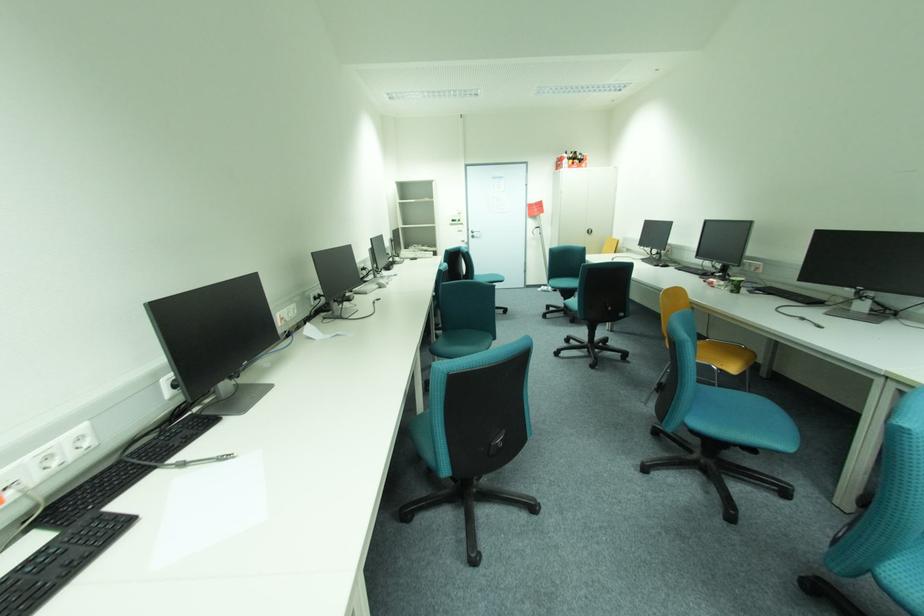
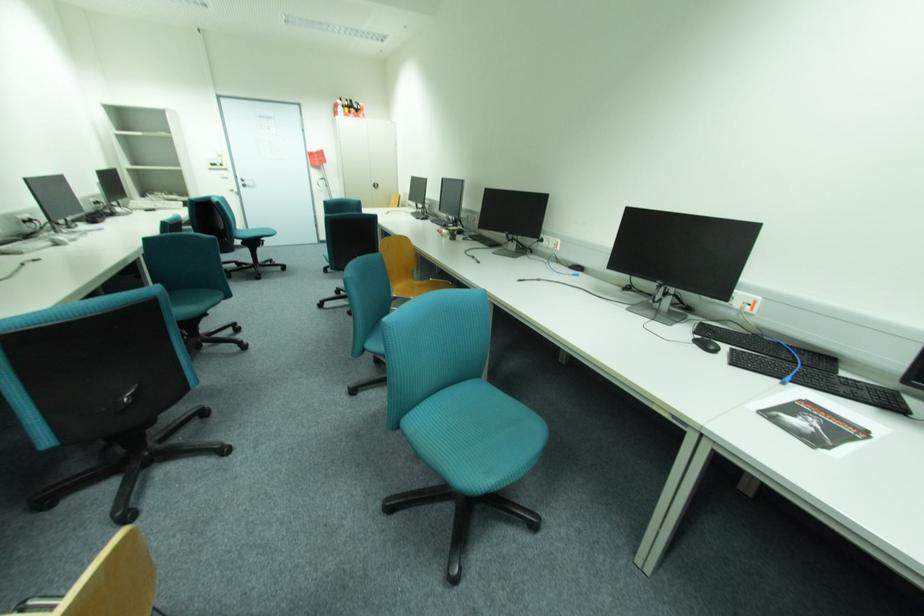
Find the pixel in the second image that matches the point at 481,235 in the first image.

(253, 183)